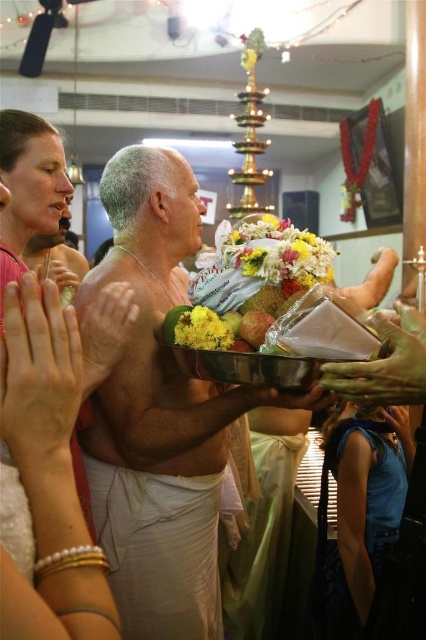
Which is more to the left, white clothed man at center or green silk robe at lower right?

From the viewer's perspective, white clothed man at center appears more on the left side.

Between point (147, 552) and point (255, 456), which one is positioned behind?

The point (255, 456) is behind.

Identify the location of white clothed man at center. The image size is (426, 640). click(x=160, y=413).

In the scene shown: Who is more distant from viewer, (198, 628) or (49, 321)?

The point (198, 628) is behind.

The height and width of the screenshot is (640, 426). Find the location of `white clothed man at center`. white clothed man at center is located at coordinates (160, 413).

Image resolution: width=426 pixels, height=640 pixels. I want to click on white clothed man at center, so click(x=160, y=413).

Between pink fabric at upper left and yellow matte flower at center, which one appears on the right side from the viewer's perspective?

From the viewer's perspective, yellow matte flower at center appears more on the right side.

Looking at this image, between pink fabric at upper left and yellow matte flower at center, which one is positioned higher?

pink fabric at upper left

At what (x,y) coordinates should I click in order to perform the action: click on pink fabric at upper left. Please return your answer as a coordinate pair (x, y). The height and width of the screenshot is (640, 426). Looking at the image, I should click on (x=43, y=406).